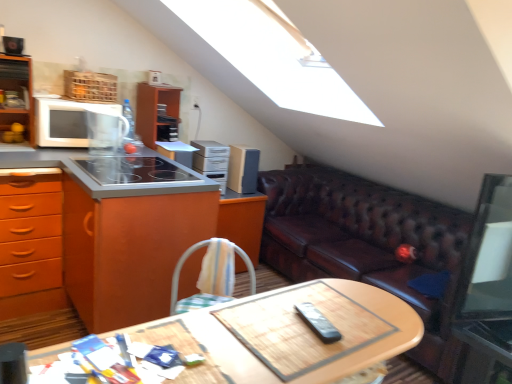
You are a GUI agent. You are given a task and a screenshot of the screen. Output one action in this format:
    pyautogui.click(x=<x>, y=<y>)
    Task: Click on the vacant point above satin silver toaster at center, which is the 4th appliance in right-to-left order (from a real-world perspective)
    
    Given the screenshot: What is the action you would take?
    pyautogui.click(x=177, y=147)